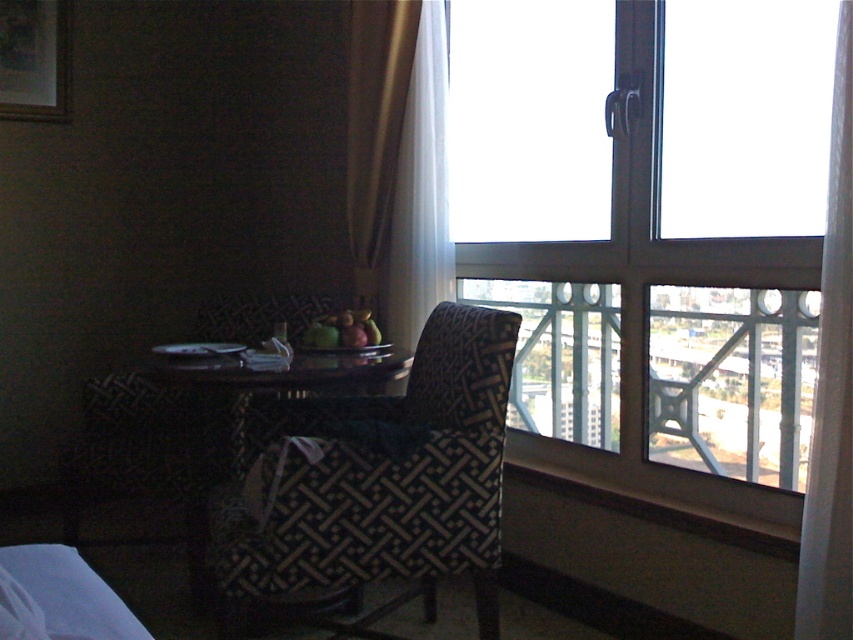
Does gold fabric curtain at upper center have a lesser height compared to black glossy table at center?

Incorrect, gold fabric curtain at upper center's height does not fall short of black glossy table at center's.

I want to click on gold fabric curtain at upper center, so click(x=375, y=129).

Is white sheer curtain at right smaller than black glossy table at center?

Correct, white sheer curtain at right occupies less space than black glossy table at center.

Is point (838, 67) more distant than point (189, 365)?

No, it is in front of (189, 365).

Locate an element on the screen. Image resolution: width=853 pixels, height=640 pixels. white sheer curtain at right is located at coordinates (833, 388).

Which is in front, point (456, 266) or point (389, 340)?

Point (456, 266)

Is point (622, 8) positioned in front of point (407, 237)?

Yes.

Is point (497, 273) positioned after point (440, 108)?

No, (497, 273) is in front of (440, 108).

Where is `transparent glass window at upper right`? This screenshot has height=640, width=853. transparent glass window at upper right is located at coordinates (645, 289).